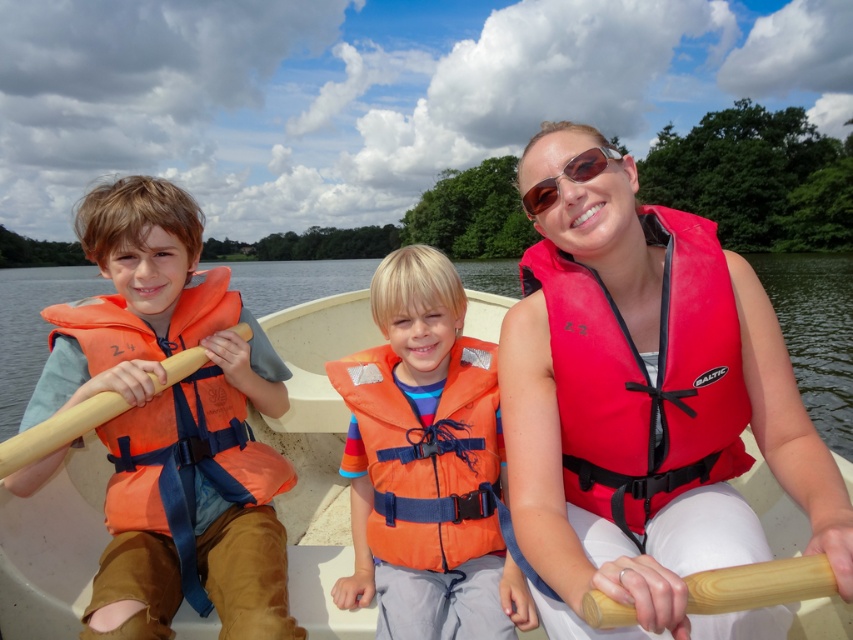
Who is higher up, red nylon life jacket at right or wooden paddle at center?

red nylon life jacket at right

Does red nylon life jacket at right have a greater height compared to wooden paddle at center?

Correct, red nylon life jacket at right is much taller as wooden paddle at center.

Is point (567, 269) positioned in front of point (618, 612)?

No.

Where is `red nylon life jacket at right`? Image resolution: width=853 pixels, height=640 pixels. red nylon life jacket at right is located at coordinates click(643, 376).

Does white plastic boat at center appear under sunglasses at center?

No.

Can you confirm if white plastic boat at center is bigger than sunglasses at center?

Yes.

Between point (79, 532) and point (550, 196), which one is positioned behind?

The point (79, 532) is more distant.

Locate an element on the screen. Image resolution: width=853 pixels, height=640 pixels. white plastic boat at center is located at coordinates (315, 419).

Does white plastic boat at center appear under wooden paddle at left?

No, white plastic boat at center is not below wooden paddle at left.

Does point (47, 292) lie behind point (120, 397)?

That is True.

Locate an element on the screen. The image size is (853, 640). white plastic boat at center is located at coordinates (315, 419).